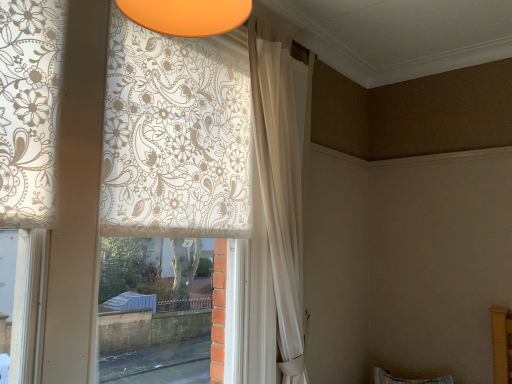
Question: In terms of height, does white floral-patterned curtain at upper left, arranged as the 1th curtain when viewed from the left, look taller or shorter compared to white sheer curtain at upper center, which appears as the second curtain when viewed from the left?

Choices:
 (A) tall
 (B) short

Answer: (B)

Question: Which is correct: white floral-patterned curtain at upper left, the second curtain viewed from the right, is inside white sheer curtain at upper center, which appears as the second curtain when viewed from the left, or outside of it?

Choices:
 (A) outside
 (B) inside

Answer: (A)

Question: Based on their positions, is white floral-patterned curtain at upper left, arranged as the 1th curtain when viewed from the left, located to the left or right of white sheer curtain at upper center, the 1th curtain when ordered from right to left?

Choices:
 (A) left
 (B) right

Answer: (A)

Question: Choose the correct answer: Is white sheer curtain at upper center, the 1th curtain when ordered from right to left, inside white floral-patterned curtain at upper left, arranged as the 1th curtain when viewed from the left, or outside it?

Choices:
 (A) inside
 (B) outside

Answer: (B)

Question: Visually, is white sheer curtain at upper center, the 1th curtain when ordered from right to left, positioned to the left or to the right of white floral-patterned curtain at upper left, arranged as the 1th curtain when viewed from the left?

Choices:
 (A) right
 (B) left

Answer: (A)

Question: From a real-world perspective, is white sheer curtain at upper center, which appears as the second curtain when viewed from the left, above or below white floral-patterned curtain at upper left, the second curtain viewed from the right?

Choices:
 (A) above
 (B) below

Answer: (A)

Question: Based on their sizes in the image, would you say white sheer curtain at upper center, which appears as the second curtain when viewed from the left, is bigger or smaller than white floral-patterned curtain at upper left, arranged as the 1th curtain when viewed from the left?

Choices:
 (A) big
 (B) small

Answer: (B)